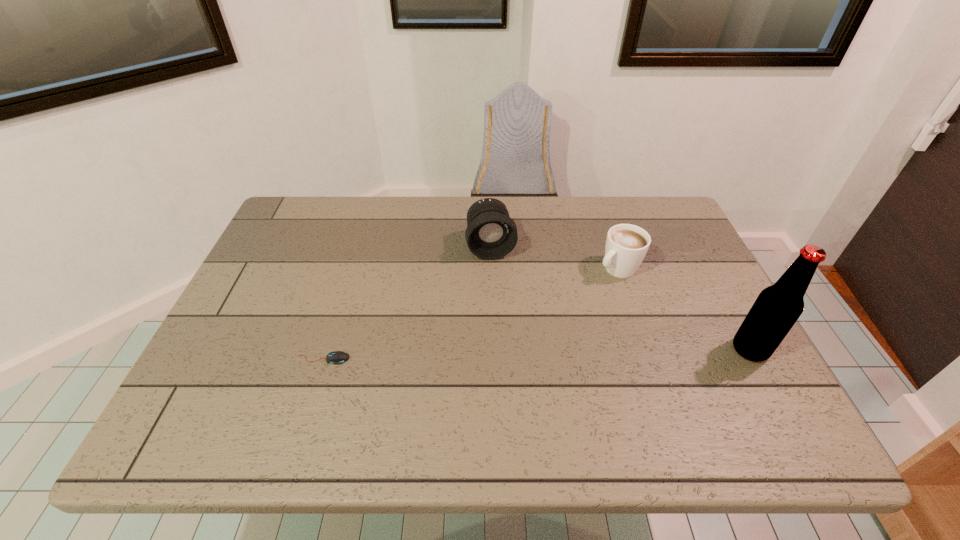
Where is `vacant spot on the desktop that is between the shortest object and the beer bottle and is positioned at the front element of the third shortest object`? The width and height of the screenshot is (960, 540). vacant spot on the desktop that is between the shortest object and the beer bottle and is positioned at the front element of the third shortest object is located at coordinates (513, 355).

You are a GUI agent. You are given a task and a screenshot of the screen. Output one action in this format:
    pyautogui.click(x=<x>, y=<y>)
    Task: Click on the free space on the desktop that is between the leftmost object and the tallest object and is positioned with the handle on the side of the cappuccino
    The image size is (960, 540).
    Given the screenshot: What is the action you would take?
    [493, 355]